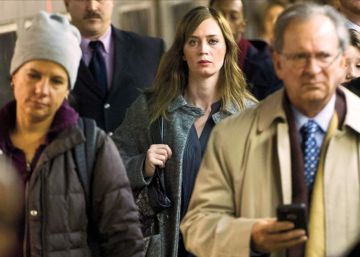
Identify the location of phone. This screenshot has height=257, width=360. (299, 216).